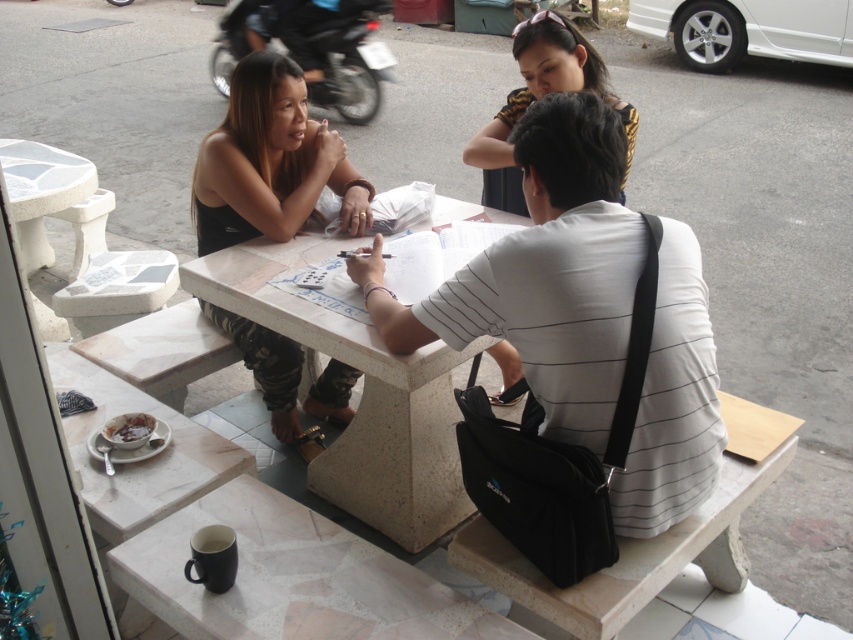
Does black fabric bag at lower right have a larger size compared to yellow/black striped shirt at upper center?

Incorrect, black fabric bag at lower right is not larger than yellow/black striped shirt at upper center.

Is point (723, 481) farther from viewer compared to point (521, 90)?

That is False.

Measure the distance between black fabric bag at lower right and camera.

black fabric bag at lower right and camera are 5.09 feet apart.

Find the location of a particular element. black fabric bag at lower right is located at coordinates (646, 538).

Is white marble table at center thinner than camouflage pants at center?

No, white marble table at center is not thinner than camouflage pants at center.

The width and height of the screenshot is (853, 640). Identify the location of white marble table at center. (361, 394).

The width and height of the screenshot is (853, 640). In order to click on white marble table at center in this screenshot , I will do `click(361, 394)`.

Which is in front, point (392, 390) or point (556, 58)?

Point (392, 390) is in front.

Image resolution: width=853 pixels, height=640 pixels. What do you see at coordinates (361, 394) in the screenshot?
I see `white marble table at center` at bounding box center [361, 394].

I want to click on white marble table at center, so click(361, 394).